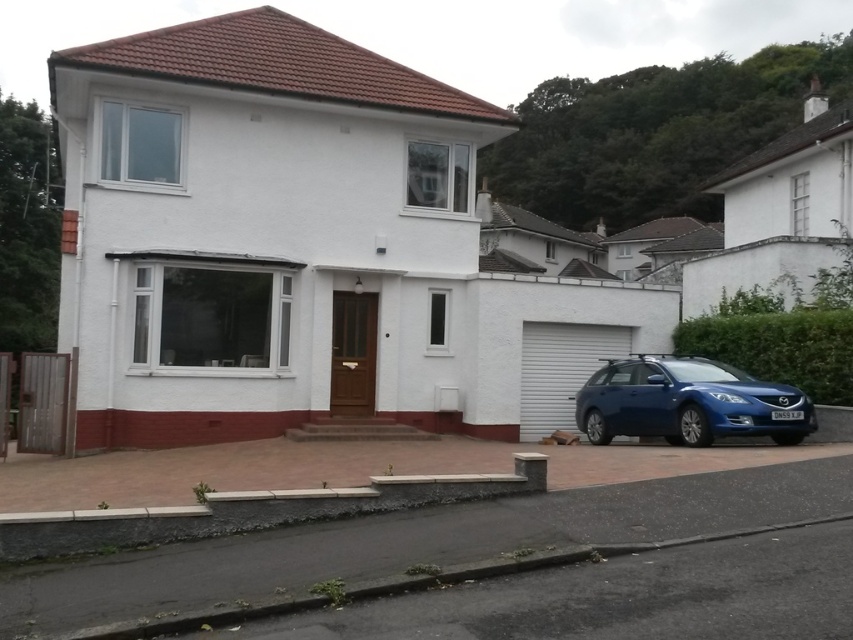
Question: Which of the following is the closest to the observer?

Choices:
 (A) (273, 566)
 (B) (729, 394)
 (C) (146, 488)

Answer: (A)

Question: Among these points, which one is nearest to the camera?

Choices:
 (A) (305, 451)
 (B) (695, 522)

Answer: (B)

Question: Which point appears closest to the camera in this image?

Choices:
 (A) click(708, 474)
 (B) click(592, 456)

Answer: (A)

Question: Can you confirm if brick paved driveway at lower center is positioned below paved concrete driveway at center?

Choices:
 (A) no
 (B) yes

Answer: (A)

Question: Does brick paved driveway at lower center have a greater width compared to blue metallic car at lower right?

Choices:
 (A) no
 (B) yes

Answer: (A)

Question: Considering the relative positions of brick paved driveway at lower center and blue metallic car at lower right in the image provided, where is brick paved driveway at lower center located with respect to blue metallic car at lower right?

Choices:
 (A) below
 (B) above

Answer: (A)